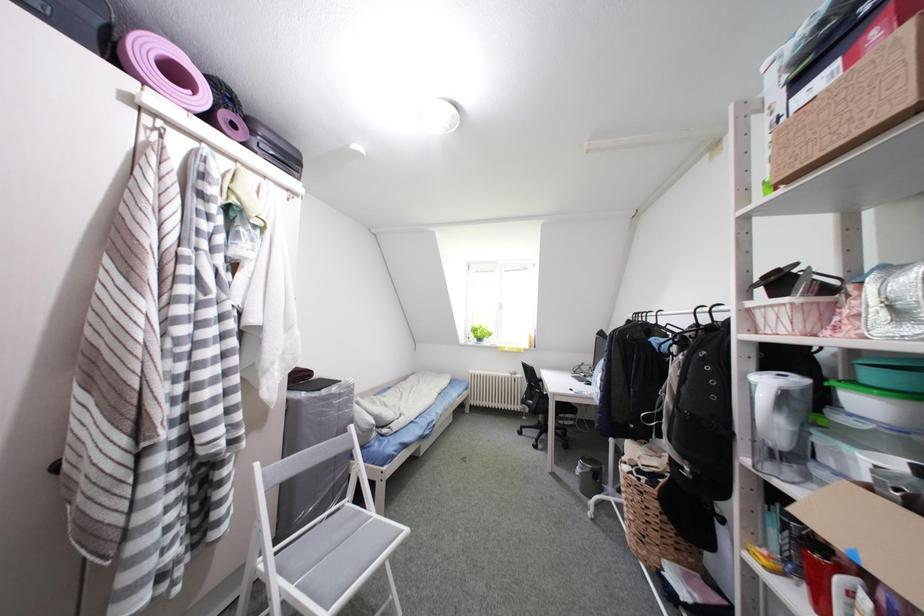
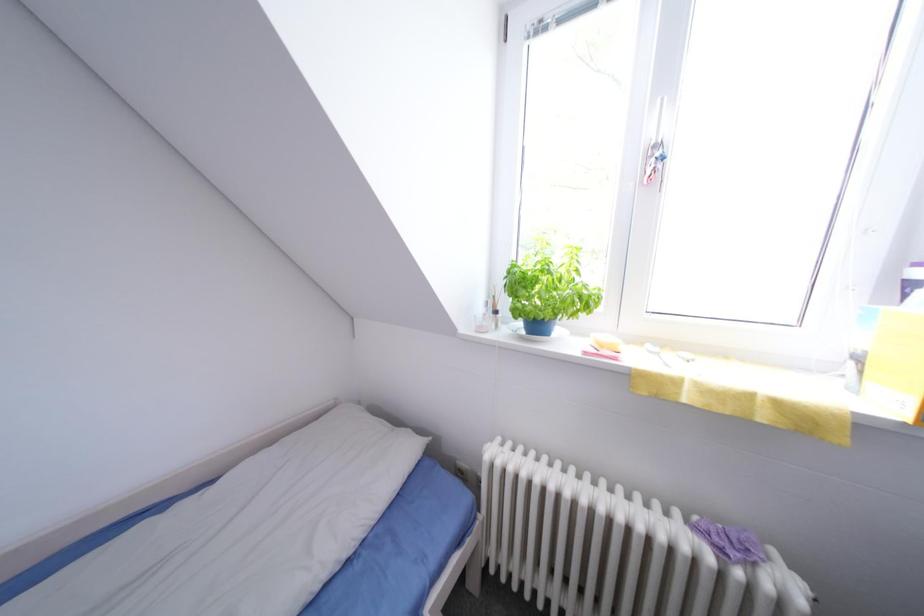
Question: The images are taken continuously from a first-person perspective. In which direction are you moving?

Choices:
 (A) Left
 (B) Right
 (C) Forward
 (D) Backward

Answer: (C)